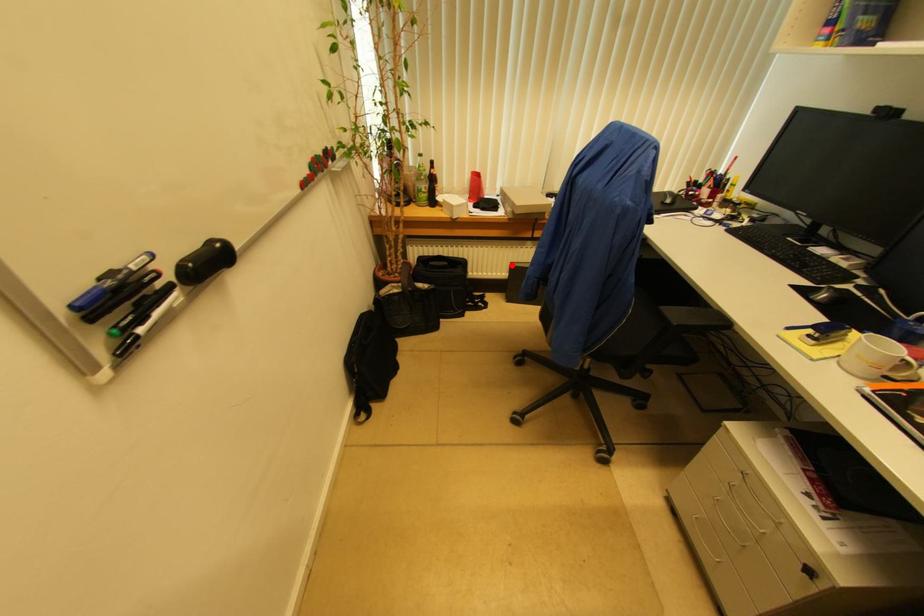
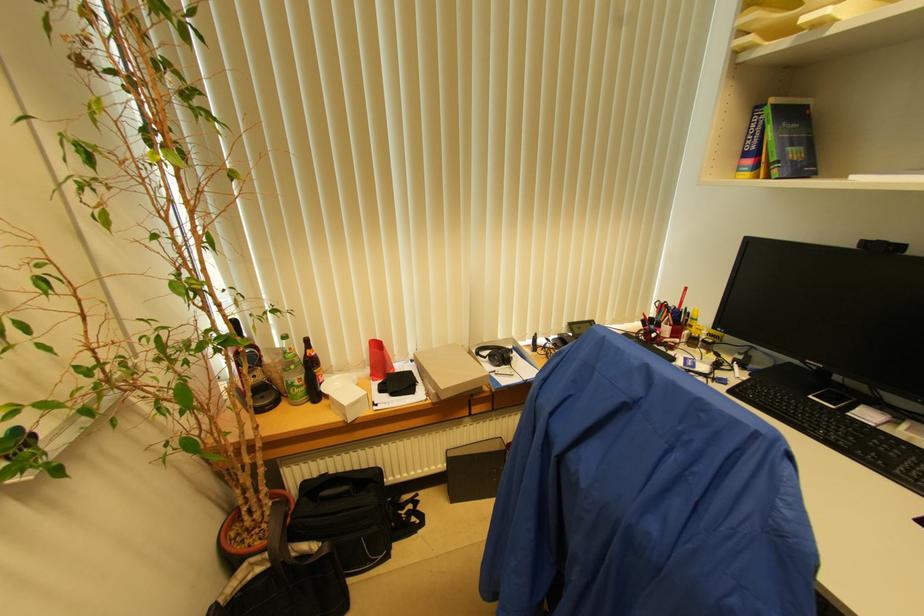
Where in the second image is the point corresponding to the highlighted location from the first image?

(447, 453)